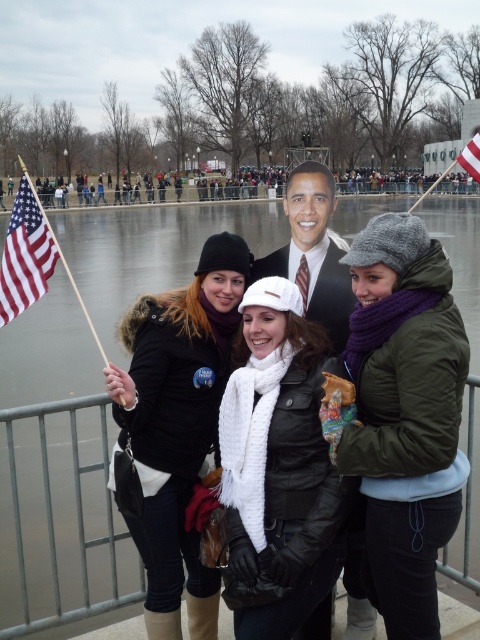
Question: Which object appears farthest from the camera in this image?

Choices:
 (A) smooth plastic obama head at center
 (B) white knitted hat at center
 (C) american flag at left
 (D) american flag at upper right

Answer: (D)

Question: Does metal fence at lower center appear under american flag at upper right?

Choices:
 (A) yes
 (B) no

Answer: (A)

Question: Is metal fence at lower center above smooth plastic obama head at center?

Choices:
 (A) no
 (B) yes

Answer: (A)

Question: Among these objects, which one is farthest from the camera?

Choices:
 (A) smooth plastic obama head at center
 (B) metal fence at lower center

Answer: (B)

Question: Which point is farther to the camera?

Choices:
 (A) purple wool scarf at center
 (B) metal fence at lower center

Answer: (B)

Question: Does metal fence at lower center have a greater width compared to american flag at upper right?

Choices:
 (A) yes
 (B) no

Answer: (B)